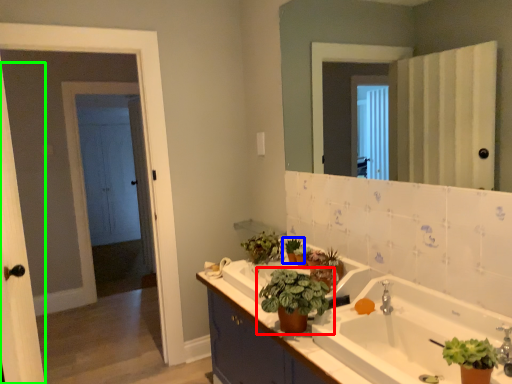
Question: Which object is positioned closest to houseplant (highlighted by a red box)? Select from houseplant (highlighted by a blue box) and screen door (highlighted by a green box).

Choices:
 (A) houseplant
 (B) screen door

Answer: (A)